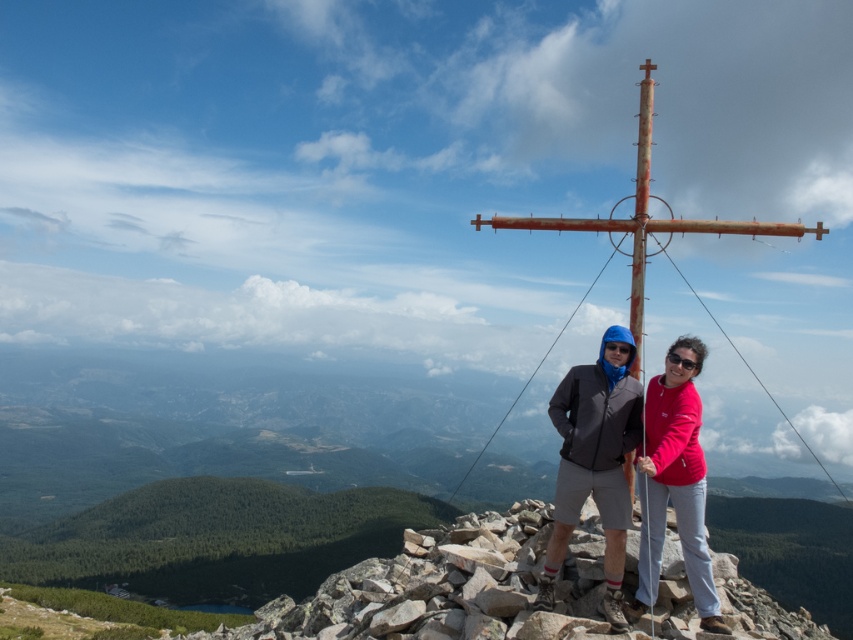
Question: Is matte gray jacket at center bigger than matte pink sweatshirt at center?

Choices:
 (A) yes
 (B) no

Answer: (A)

Question: Can you confirm if matte gray jacket at center is wider than matte pink sweatshirt at center?

Choices:
 (A) yes
 (B) no

Answer: (A)

Question: Which object appears farthest from the camera in this image?

Choices:
 (A) matte gray jacket at center
 (B) matte pink sweatshirt at center

Answer: (B)

Question: Which point is farther from the camera taking this photo?

Choices:
 (A) (662, 532)
 (B) (547, 609)

Answer: (A)

Question: Does matte gray jacket at center have a larger size compared to matte pink sweatshirt at center?

Choices:
 (A) no
 (B) yes

Answer: (B)